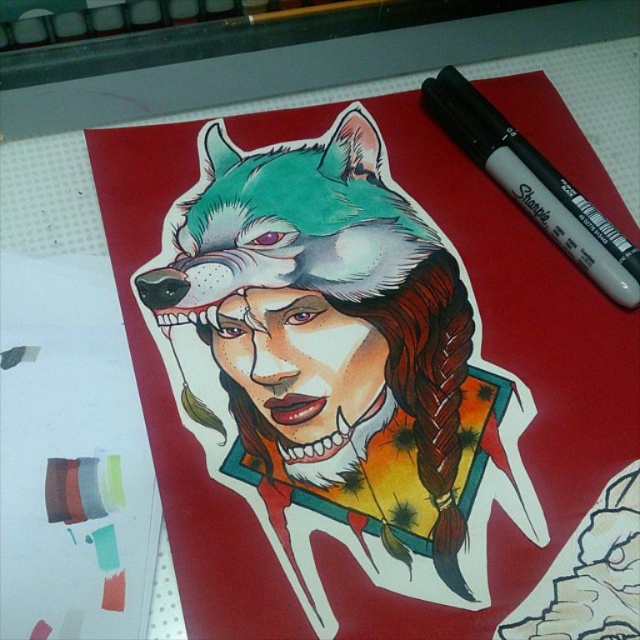
You are an artist holding a black marker at upper right and want to draw a shiny metallic wolf head at center on a canvas. Based on the image, will the wolf head require more space horizontally than the marker itself?

The shiny metallic wolf head at center is wider than the black marker at upper right, so yes, the wolf head will require more horizontal space than the marker itself.

You are an artist examining the character in the image. You notice two points marked on their face. Which point is closer to you, point 1 at coordinates (214, 275) or point 2 at coordinates (573, 244)?

Point 1 at coordinates (214, 275) is closer to the viewer than point 2 at coordinates (573, 244).